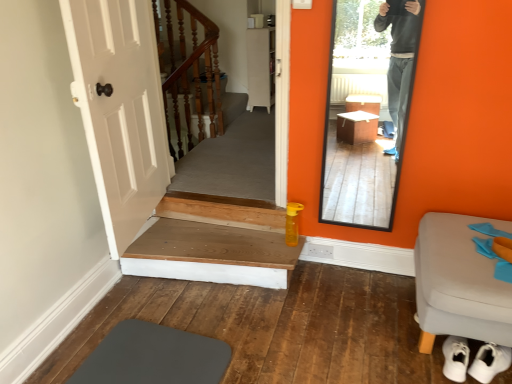
Question: Is wooden at upper left, arranged as the 1th stairs when viewed from the back, not within clear glass mirror at right?

Choices:
 (A) yes
 (B) no

Answer: (A)

Question: From the image's perspective, is wooden at upper left, arranged as the 1th stairs when viewed from the back, under clear glass mirror at right?

Choices:
 (A) yes
 (B) no

Answer: (B)

Question: From a real-world perspective, is wooden at upper left, arranged as the 1th stairs when viewed from the back, below clear glass mirror at right?

Choices:
 (A) yes
 (B) no

Answer: (B)

Question: Is clear glass mirror at right surrounded by wooden at upper left, arranged as the 1th stairs when viewed from the back?

Choices:
 (A) no
 (B) yes

Answer: (A)

Question: Considering the relative positions of wooden at upper left, which is counted as the second stairs, starting from the front, and clear glass mirror at right in the image provided, is wooden at upper left, which is counted as the second stairs, starting from the front, to the right of clear glass mirror at right from the viewer's perspective?

Choices:
 (A) yes
 (B) no

Answer: (B)

Question: Is wooden at upper left, the 2th stairs from the bottom, in contact with clear glass mirror at right?

Choices:
 (A) no
 (B) yes

Answer: (A)

Question: From a real-world perspective, is white fabric stool at lower right physically below white matte cabinet at center?

Choices:
 (A) no
 (B) yes

Answer: (B)

Question: From a real-world perspective, is white fabric stool at lower right located higher than white matte cabinet at center?

Choices:
 (A) no
 (B) yes

Answer: (A)

Question: Are white fabric stool at lower right and white matte cabinet at center far apart?

Choices:
 (A) yes
 (B) no

Answer: (A)

Question: Can you confirm if white fabric stool at lower right is smaller than white matte cabinet at center?

Choices:
 (A) yes
 (B) no

Answer: (B)

Question: Is the position of white fabric stool at lower right less distant than that of white matte cabinet at center?

Choices:
 (A) yes
 (B) no

Answer: (A)

Question: Can you confirm if white fabric stool at lower right is wider than white matte cabinet at center?

Choices:
 (A) yes
 (B) no

Answer: (A)

Question: Is white fabric stool at lower right facing away from wooden at upper left, arranged as the 1th stairs when viewed from the back?

Choices:
 (A) yes
 (B) no

Answer: (B)